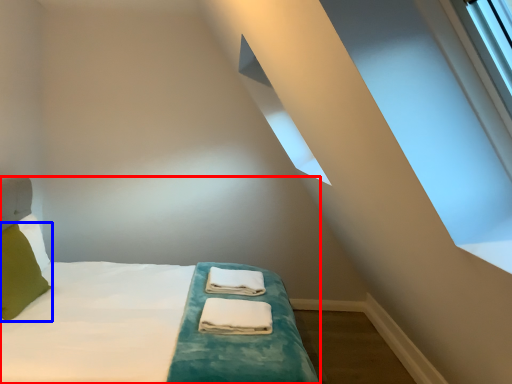
Question: Which object is further to the camera taking this photo, bed (highlighted by a red box) or pillow (highlighted by a blue box)?

Choices:
 (A) bed
 (B) pillow

Answer: (B)